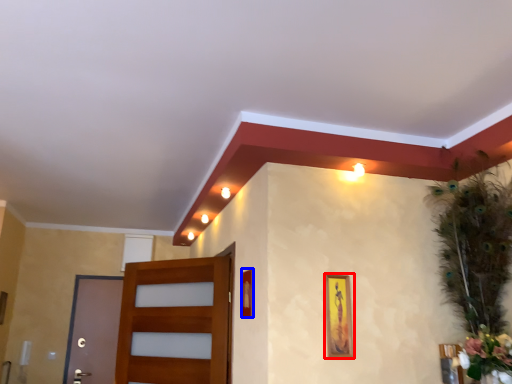
Question: Which object is further to the camera taking this photo, picture frame (highlighted by a red box) or picture frame (highlighted by a blue box)?

Choices:
 (A) picture frame
 (B) picture frame

Answer: (B)